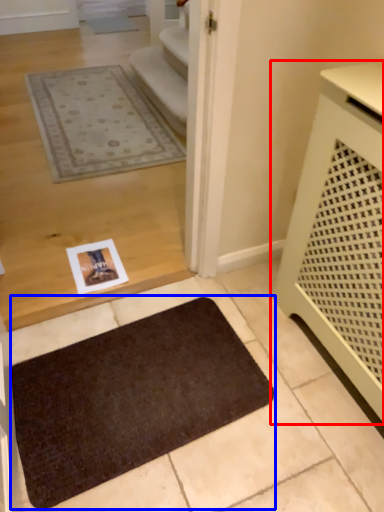
Question: Which of the following is the farthest to the observer, furniture (highlighted by a red box) or mat (highlighted by a blue box)?

Choices:
 (A) furniture
 (B) mat

Answer: (B)